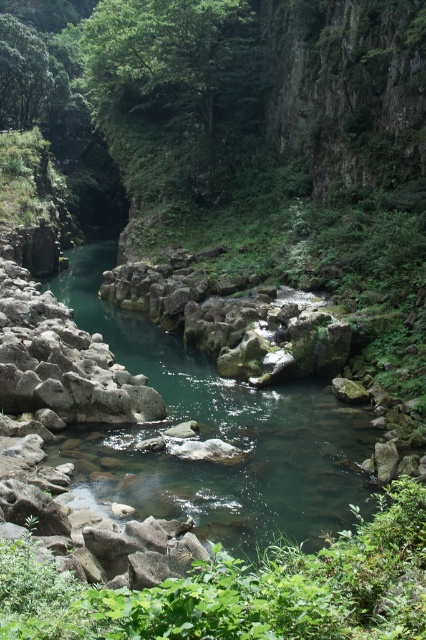
You are planning to cross the river using a small wooden bridge that is 1.2 meters wide. The bridge is placed between the green smooth water at center and the green leafy shrubs at center. Can the bridge fit between them without touching either side?

The green smooth water at center might be wider than green leafy shrubs at center, so the bridge may fit between them. However, since the exact width isn 2023.09.27T14.30.45.456Z Okay, let me try to work through this problem step by step. First, I need to understand the given information. The scene is a serene landscape with a river and shrubs. The objects mentioned are

You are standing at the edge of the river and want to reach a specific point in the valley. You see two points marked on the landscape, point (138, 500) and point (236, 582). Which point is closer to you?

Point (138, 500) is closer to you because it is further to the viewer than point (236, 582).

You are a hiker planning to cross the river using a narrow path between the green smooth water at center and the green leafy shrubs at center. The path is 15 meters wide. Can you safely cross the path without getting wet?

The distance between the green smooth water at center and the green leafy shrubs at center is 18.24 meters. Since the path is only 15 meters wide, the path is narrower than the distance between them, so you cannot safely cross without getting wet.